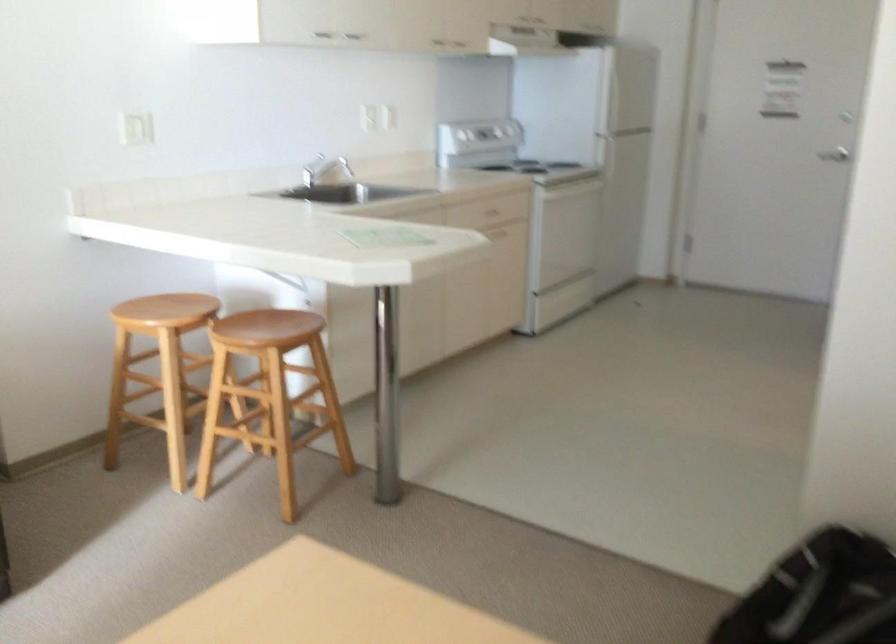
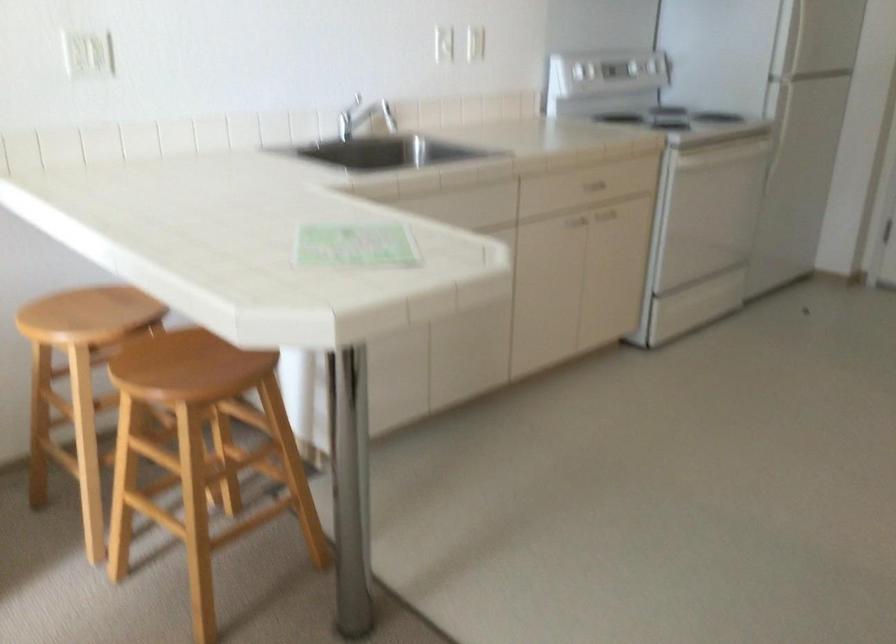
The point at (x=366, y=105) is marked in the first image. Where is the corresponding point in the second image?

(443, 41)